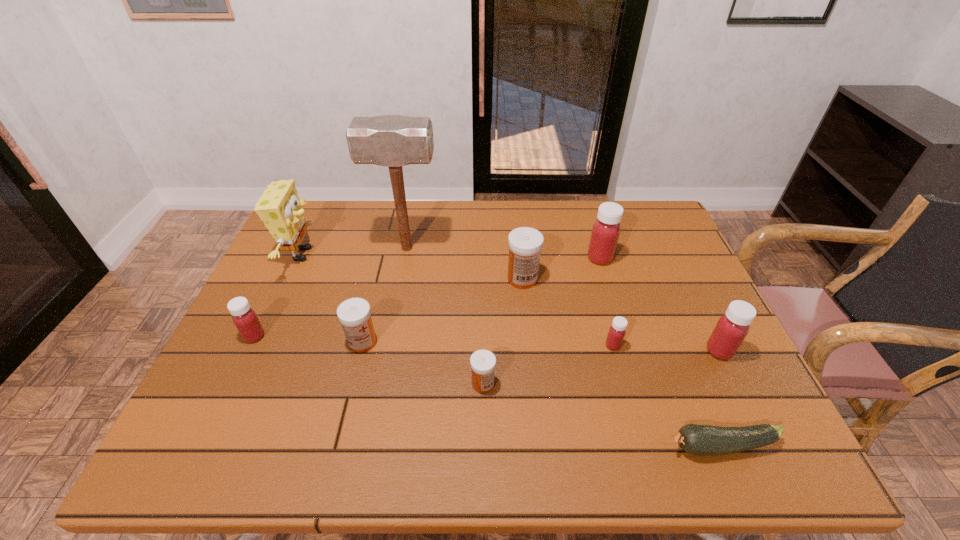
At what (x,y) coordinates should I click in order to perform the action: click on vacant area situated 0.180m on the left of the farthest red medicine. Please return your answer as a coordinate pair (x, y). This screenshot has width=960, height=540. Looking at the image, I should click on (527, 258).

Image resolution: width=960 pixels, height=540 pixels. Find the location of `blank space located on the left of the biggest white medicine`. blank space located on the left of the biggest white medicine is located at coordinates (380, 279).

This screenshot has height=540, width=960. Identify the location of free region located on the front of the rightmost medicine. (749, 411).

Locate an element on the screen. The width and height of the screenshot is (960, 540). free region located 0.090m on the front of the sixth medicine from right to left is located at coordinates (351, 386).

Where is `free space located on the back of the leftmost medicine`? The height and width of the screenshot is (540, 960). free space located on the back of the leftmost medicine is located at coordinates (268, 308).

I want to click on free space located on the left of the smallest red medicine, so click(x=577, y=346).

At what (x,y) coordinates should I click in order to perform the action: click on vacant space located on the right of the nearest medicine. Please return your answer as a coordinate pair (x, y). This screenshot has height=540, width=960. Looking at the image, I should click on (631, 384).

Image resolution: width=960 pixels, height=540 pixels. I want to click on free location located at the blossom end of the nearest object, so click(562, 447).

Identify the location of vacant region located at the blossom end of the nearest object. The height and width of the screenshot is (540, 960). (631, 447).

Find the location of a particular element. This screenshot has height=540, width=960. free space located at the blossom end of the nearest object is located at coordinates (508, 447).